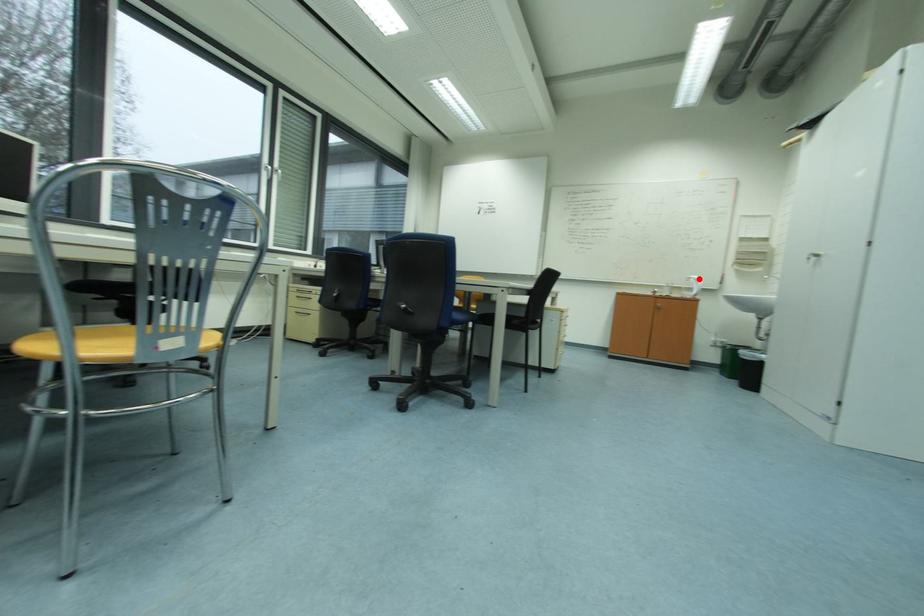
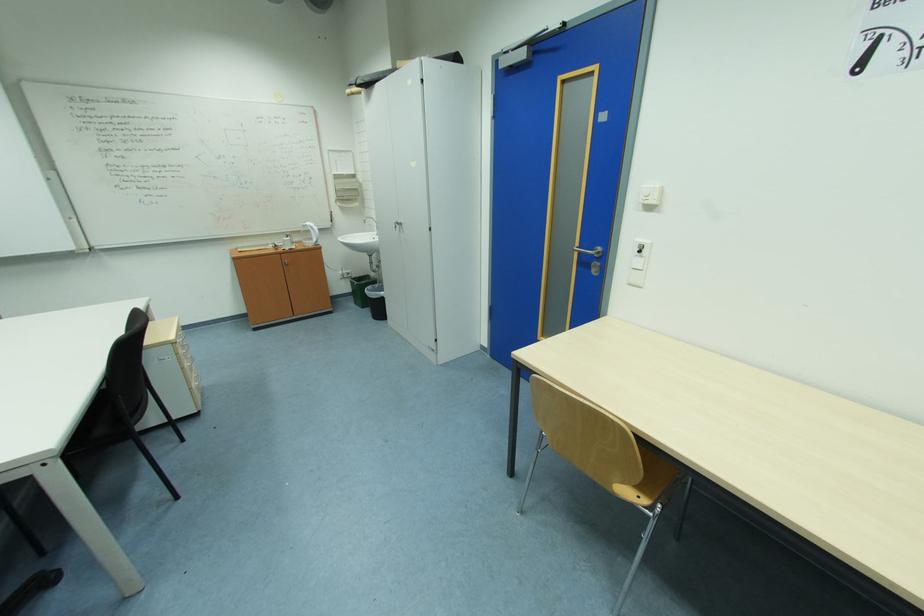
The point at the highlighted location is marked in the first image. Where is the corresponding point in the second image?

(313, 225)